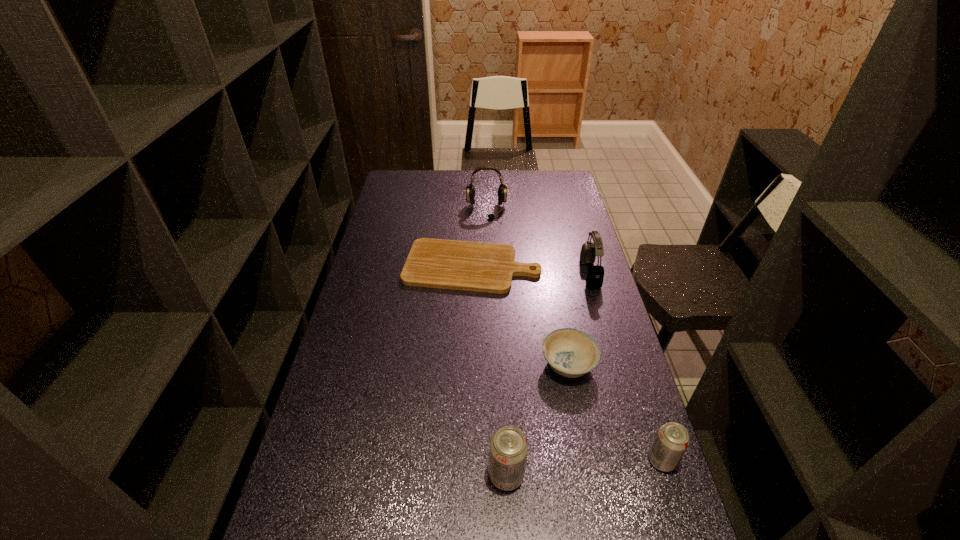
Locate an element on the screen. Image resolution: width=960 pixels, height=540 pixels. the left soda can is located at coordinates (508, 452).

The image size is (960, 540). I want to click on the third shortest object, so click(672, 440).

You are a GUI agent. You are given a task and a screenshot of the screen. Output one action in this format:
    pyautogui.click(x=<x>, y=<y>)
    Task: Click on the shorter soda can
    This screenshot has height=540, width=960.
    Given the screenshot: What is the action you would take?
    pyautogui.click(x=672, y=440)

The image size is (960, 540). Find the location of `chopping board`. chopping board is located at coordinates (483, 267).

Where is `the farthest object`? This screenshot has height=540, width=960. the farthest object is located at coordinates (470, 190).

The width and height of the screenshot is (960, 540). I want to click on the farther headset, so click(470, 190).

Identify the location of the right headset. The height and width of the screenshot is (540, 960). [595, 275].

Where is `bowl`? The width and height of the screenshot is (960, 540). bowl is located at coordinates (572, 353).

The width and height of the screenshot is (960, 540). Identify the location of the third nearest object. (572, 353).

Where is `free space located 0.060m on the front of the left soda can`? This screenshot has height=540, width=960. free space located 0.060m on the front of the left soda can is located at coordinates (509, 521).